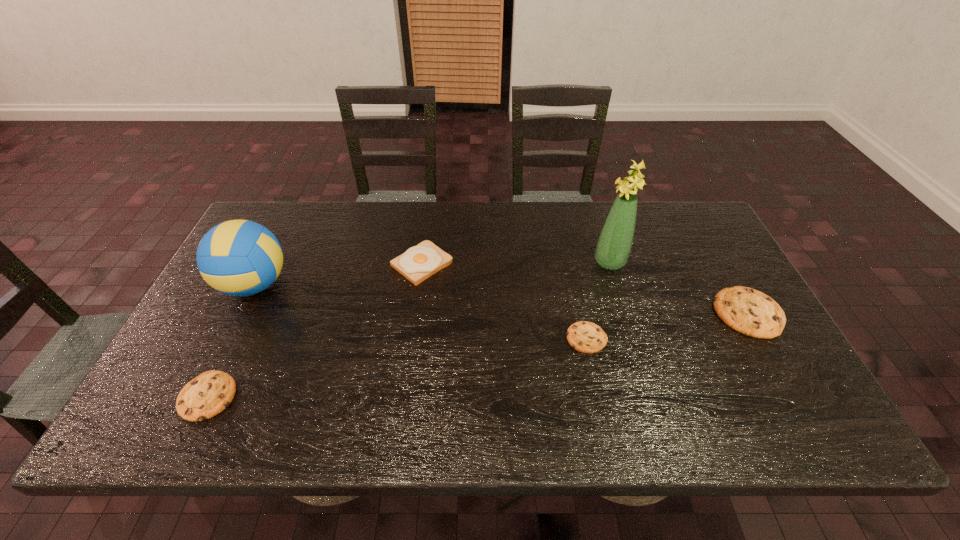
Where is `vacant space located 0.390m on the right of the nearest object`? The height and width of the screenshot is (540, 960). vacant space located 0.390m on the right of the nearest object is located at coordinates (409, 396).

Identify the location of vacant space located 0.390m on the left of the second cookie from left to right. (411, 338).

Locate an element on the screen. The image size is (960, 540). free space located 0.320m on the left of the rightmost object is located at coordinates (594, 313).

Find the location of a particular element. free space located 0.290m on the back of the second tallest object is located at coordinates [x=296, y=203].

Where is `vacant space situated 0.090m on the front of the fourth object from right to left`? This screenshot has height=540, width=960. vacant space situated 0.090m on the front of the fourth object from right to left is located at coordinates (416, 310).

I want to click on free spot located on the front-facing side of the second object from right to left, so click(x=577, y=262).

Identify the location of free space located 0.380m on the front-facing side of the second object from right to left. [x=465, y=262].

Identify the location of vacant area situated 0.320m on the front-facing side of the second object from right to left. This screenshot has width=960, height=540. coord(486,262).

The height and width of the screenshot is (540, 960). What are the coordinates of `object located in the far edge section of the desktop` in the screenshot? It's located at (418, 263).

Image resolution: width=960 pixels, height=540 pixels. I want to click on object located at the near edge, so 207,395.